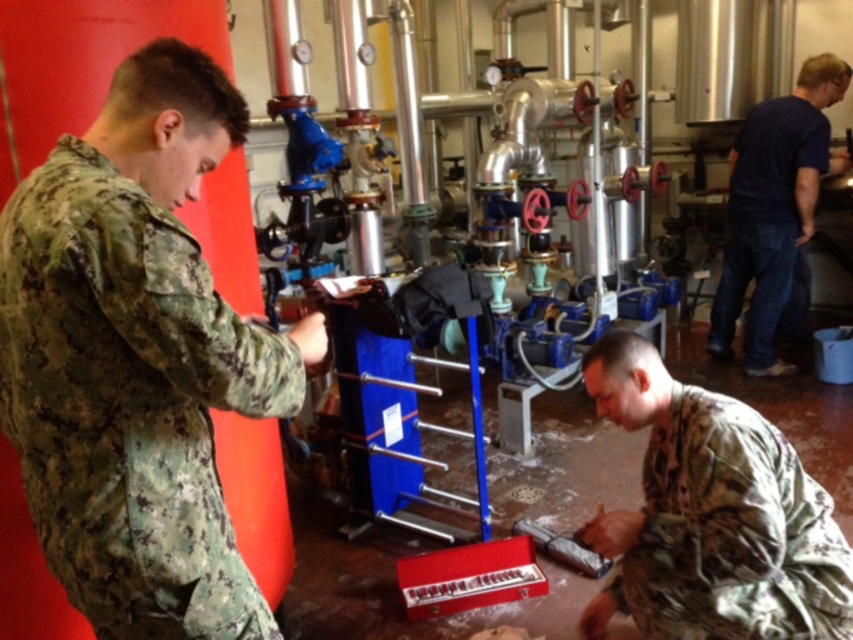
You are an inspector in the workshop. You need to locate the camouflage fabric uniform at left. Where exactly is it located in the workshop?

The camouflage fabric uniform at left is located at point [137,358] in the workshop.

You are a safety inspector in this workshop. You need to ensure that all workers are wearing proper attire. You notice two workers near the machinery. One is wearing a camouflage fabric uniform at lower right and the other has a dark blue shirt at right. Which worker is wearing clothing that might not meet the safety standards due to size being too small?

The camouflage fabric uniform at lower right has a smaller size compared to the dark blue shirt at right, so the worker in the camouflage fabric uniform at lower right might not meet the safety standards due to the size being too small.